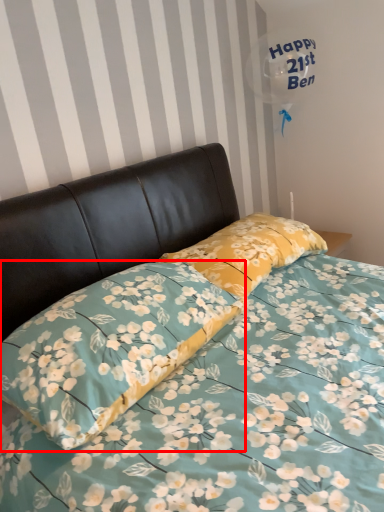
Question: From the image's perspective, what is the correct spatial relationship of pillow (annotated by the red box) in relation to pillow?

Choices:
 (A) above
 (B) below

Answer: (B)